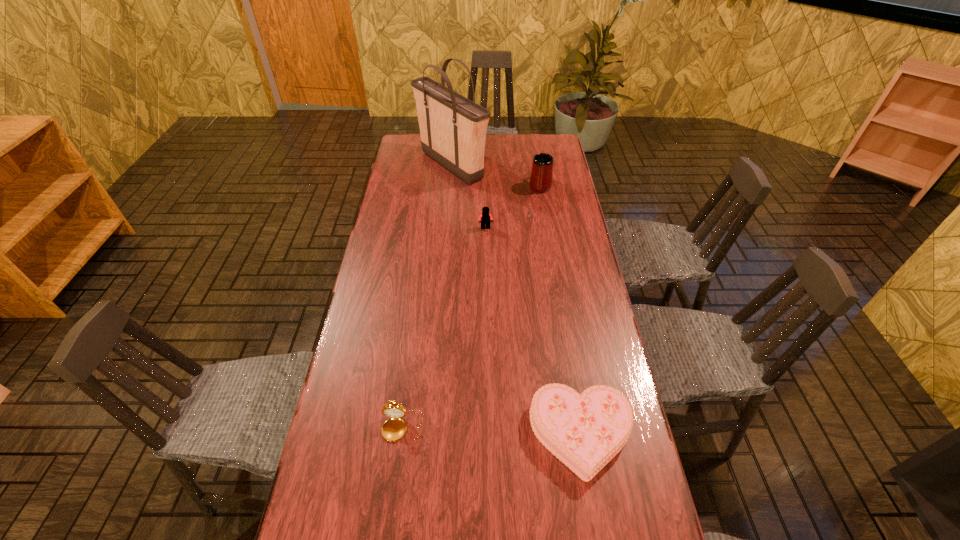
Identify the location of the tallest object. The width and height of the screenshot is (960, 540). (453, 128).

This screenshot has height=540, width=960. I want to click on mug, so (x=541, y=175).

Image resolution: width=960 pixels, height=540 pixels. Identify the location of the third farthest object. (485, 217).

You are a GUI agent. You are given a task and a screenshot of the screen. Output one action in this format:
    pyautogui.click(x=<x>, y=<y>)
    Task: Click on the pocket watch
    This screenshot has height=540, width=960.
    Given the screenshot: What is the action you would take?
    pyautogui.click(x=394, y=429)

At what (x,y) coordinates should I click in order to perform the action: click on the shortest object. Please return your answer as a coordinate pair (x, y). This screenshot has width=960, height=540. Looking at the image, I should click on (586, 431).

Find the location of a particular element. vacant area located on the front of the tallest object is located at coordinates (444, 253).

Where is `free space located 0.220m on the side of the second tallest object with the handle`? Image resolution: width=960 pixels, height=540 pixels. free space located 0.220m on the side of the second tallest object with the handle is located at coordinates (534, 150).

Where is `vacant region located 0.290m on the side of the second tallest object with the handle`? vacant region located 0.290m on the side of the second tallest object with the handle is located at coordinates (533, 141).

Locate an element on the screen. This screenshot has width=960, height=540. free space located 0.350m on the side of the second tallest object with the handle is located at coordinates (532, 135).

I want to click on vacant space located 0.370m on the front-facing side of the third farthest object, so click(487, 309).